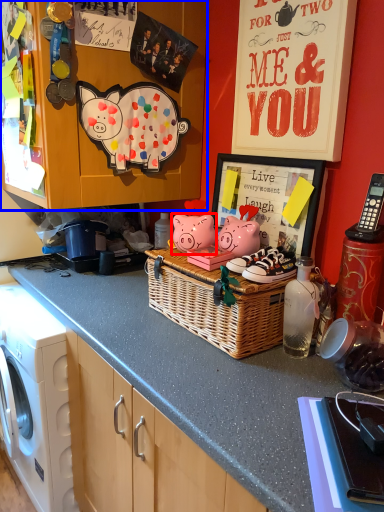
Question: Among these objects, which one is nearest to the camera, pig (highlighted by a red box) or cabinetry (highlighted by a blue box)?

Choices:
 (A) pig
 (B) cabinetry

Answer: (B)